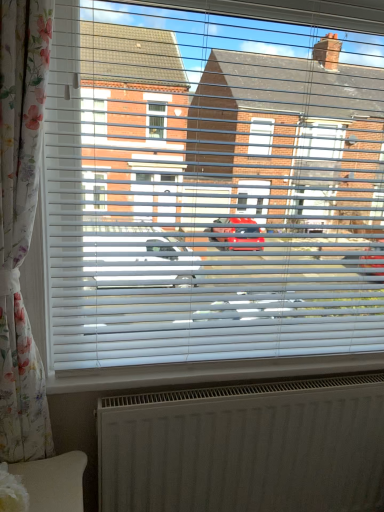
What do you see at coordinates (245, 447) in the screenshot? Image resolution: width=384 pixels, height=512 pixels. I see `white textured radiator at lower center` at bounding box center [245, 447].

You are a GUI agent. You are given a task and a screenshot of the screen. Output one action in this format:
    pyautogui.click(x=<x>, y=<y>)
    Task: Click on the floral fabric curtain at left
    The image size is (384, 512).
    Given the screenshot: What is the action you would take?
    pyautogui.click(x=21, y=223)

Describe the element at coordinates (210, 189) in the screenshot. The height and width of the screenshot is (512, 384). I see `white plastic blinds at center` at that location.

Where is `white textured radiator at lower center`? This screenshot has height=512, width=384. white textured radiator at lower center is located at coordinates (245, 447).

Is white textured radiator at lower center in contact with floral fabric curtain at left?

No, white textured radiator at lower center is not in contact with floral fabric curtain at left.

Is floral fabric curtain at left a part of white textured radiator at lower center?

No, floral fabric curtain at left is located outside of white textured radiator at lower center.

Is white textured radiator at lower center at the left side of floral fabric curtain at left?

Incorrect, white textured radiator at lower center is not on the left side of floral fabric curtain at left.

Measure the distance between white textured radiator at lower center and floral fabric curtain at left.

The distance of white textured radiator at lower center from floral fabric curtain at left is 25.79 inches.

From a real-world perspective, is white plastic blinds at center beneath floral fabric curtain at left?

Incorrect, from a real-world perspective, white plastic blinds at center is higher than floral fabric curtain at left.

Which is more distant, (333,149) or (25,146)?

The point (333,149) is behind.

Locate an element on the screen. The image size is (384, 512). curtain located on the left of white plastic blinds at center is located at coordinates (21, 223).

Considering the positions of points (295, 445) and (150, 203), is point (295, 445) farther from camera compared to point (150, 203)?

Yes.

Identify the location of window above the white textured radiator at lower center (from a real-world perspective). Image resolution: width=384 pixels, height=512 pixels. tap(210, 189).

Considering the relative positions of white textured radiator at lower center and white plastic blinds at center in the image provided, is white textured radiator at lower center behind white plastic blinds at center?

Yes, white textured radiator at lower center is behind white plastic blinds at center.

Between white textured radiator at lower center and white plastic blinds at center, which one has less height?

With less height is white textured radiator at lower center.

Is floral fabric curtain at left positioned in front of white plastic blinds at center?

Yes.

Is floral fabric curtain at left far from white plastic blinds at center?

That's not correct — floral fabric curtain at left is a little close to white plastic blinds at center.

Do you think floral fabric curtain at left is within white plastic blinds at center, or outside of it?

floral fabric curtain at left is not enclosed by white plastic blinds at center.

Between floral fabric curtain at left and white plastic blinds at center, which one has more height?

floral fabric curtain at left is taller.

Considering the sizes of objects floral fabric curtain at left and white textured radiator at lower center in the image provided, who is smaller, floral fabric curtain at left or white textured radiator at lower center?

Smaller between the two is floral fabric curtain at left.

Can you confirm if floral fabric curtain at left is positioned to the right of white textured radiator at lower center?

No, floral fabric curtain at left is not to the right of white textured radiator at lower center.

Can you see floral fabric curtain at left touching white textured radiator at lower center?

They are not placed beside each other.

What's the angular difference between floral fabric curtain at left and white textured radiator at lower center's facing directions?

The facing directions of floral fabric curtain at left and white textured radiator at lower center are 0.523 degrees apart.

Based on the photo, which object is thinner, white plastic blinds at center or white textured radiator at lower center?

Thinner between the two is white textured radiator at lower center.

Is white textured radiator at lower center at the back of white plastic blinds at center?

No, white plastic blinds at center's orientation is not away from white textured radiator at lower center.

From the image's perspective, is white plastic blinds at center located beneath white textured radiator at lower center?

No, from the image's perspective, white plastic blinds at center is not below white textured radiator at lower center.

Which is less distant, (358, 293) or (120, 424)?

Point (358, 293) is positioned farther from the camera compared to point (120, 424).

Find the location of a particular element. curtain above the white textured radiator at lower center (from a real-world perspective) is located at coordinates (21, 223).

Locate an element on the screen. window that appears behind the floral fabric curtain at left is located at coordinates (210, 189).

From the image, which object appears to be nearer to white textured radiator at lower center, floral fabric curtain at left or white plastic blinds at center?

white plastic blinds at center.

From the image, which object appears to be farther from white plastic blinds at center, white textured radiator at lower center or floral fabric curtain at left?

white textured radiator at lower center is further to white plastic blinds at center.

Looking at the image, which one is located further to floral fabric curtain at left, white plastic blinds at center or white textured radiator at lower center?

white textured radiator at lower center lies further to floral fabric curtain at left than the other object.

Looking at the image, which one is located closer to floral fabric curtain at left, white textured radiator at lower center or white plastic blinds at center?

Among the two, white plastic blinds at center is located nearer to floral fabric curtain at left.

From the picture: Based on their spatial positions, is floral fabric curtain at left or white textured radiator at lower center further from white plastic blinds at center?

white textured radiator at lower center.

Looking at the image, which one is located further to white textured radiator at lower center, white plastic blinds at center or floral fabric curtain at left?

Based on the image, floral fabric curtain at left appears to be further to white textured radiator at lower center.

Find the location of a particular element. This screenshot has height=512, width=384. curtain between white plastic blinds at center and white textured radiator at lower center vertically is located at coordinates (21, 223).